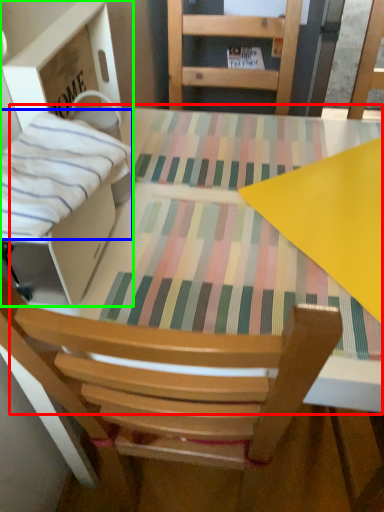
Question: Which object is the closest to the round table (highlighted by a red box)? Choose among these: blanket (highlighted by a blue box) or cardboard box (highlighted by a green box).

Choices:
 (A) blanket
 (B) cardboard box

Answer: (B)